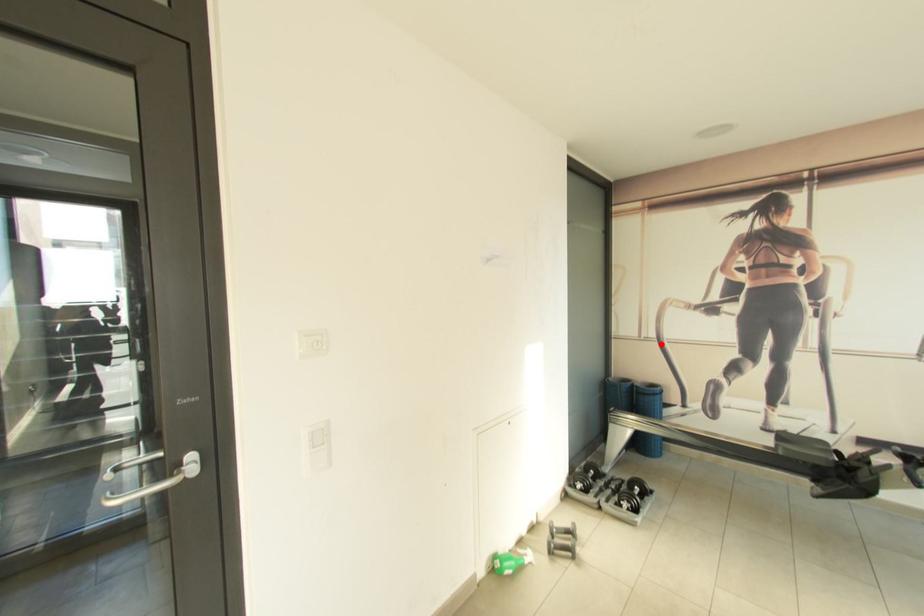
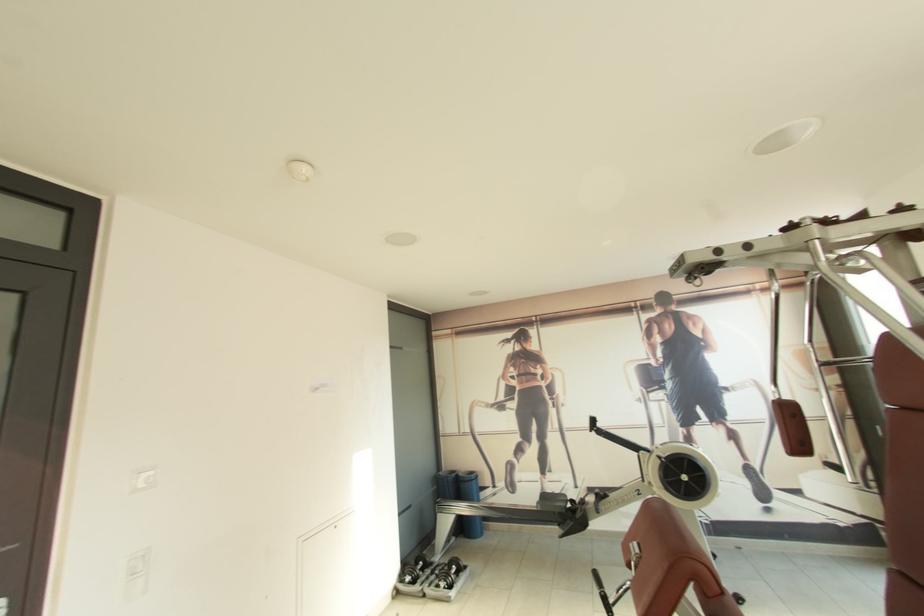
Question: I am providing you with two images of the same scene from different viewpoints. In image1, a red point is highlighted. Considering the same 3D point in image2, which of the following is correct?

Choices:
 (A) It is closer
 (B) It is farther

Answer: (B)